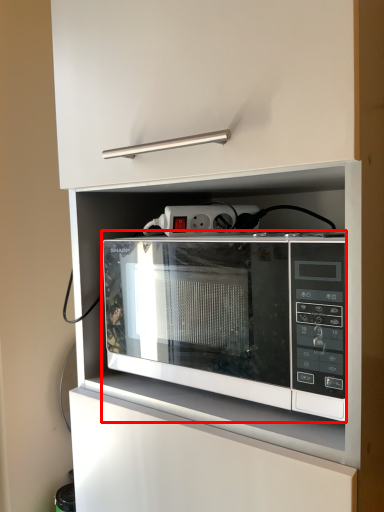
Question: From the image's perspective, where is microwave oven (annotated by the red box) located relative to electric outlet?

Choices:
 (A) below
 (B) above

Answer: (A)